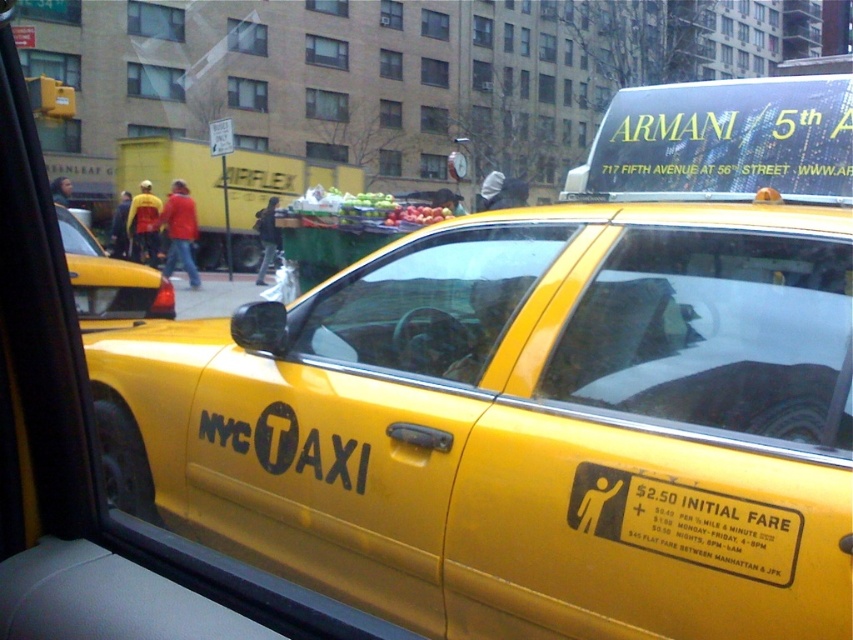
You are standing at the point marked with coordinates (523,426) in this NYC street scene. What object are you standing on?

The point (523,426) is on the yellow matte taxi at center.

You are a passenger trying to hail a taxi in the NYC street scene. There are two taxis visible in the image, the yellow matte taxi at center and the yellow matte taxi at left. Based on their positions, which taxi is closer to the curb where you are standing?

The yellow matte taxi at center is closer to the curb because it is positioned below the yellow matte taxi at left, indicating it is lower in the image and thus nearer to the ground level where the curb would be.

Looking at this image, you are standing in the middle of the street and want to determine which of the two points, point (432,452) or point (155,276), is closer to you. Based on the scene, which point is nearer?

Point (432,452) is closer to the viewer than point (155,276).